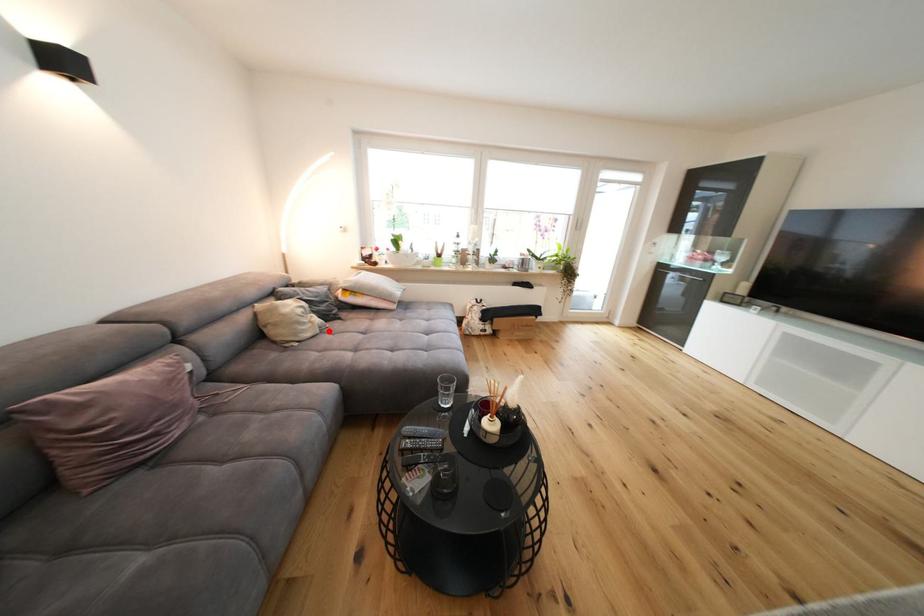
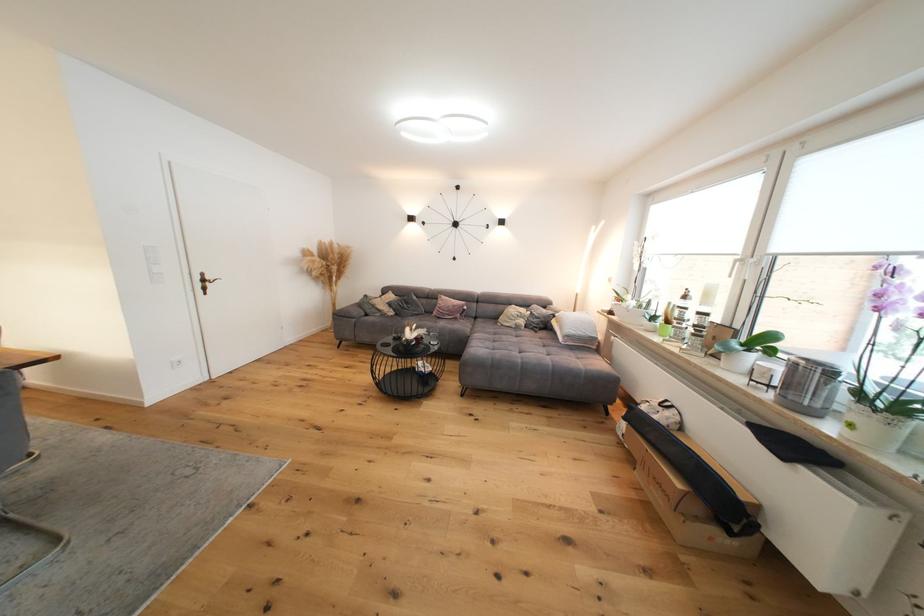
Question: I am providing you with two images of the same scene from different viewpoints. A red point is shown in image1. For the corresponding object point in image2, is it positioned nearer or farther from the camera?

Choices:
 (A) Nearer
 (B) Farther

Answer: (B)